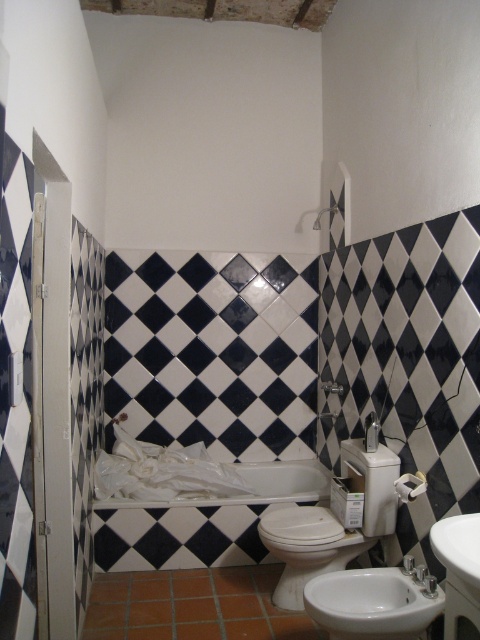
You are standing in the bathroom and want to reach the point marked at coordinates (x=400, y=600). Considering the bathroom layout described, can you estimate how far you need to move to reach that point?

The point at coordinates (x=400, y=600) is 6.83 feet away from the viewer, so you need to move approximately 6.83 feet to reach it.

You are designing a bathroom layout and want to ensure proper placement of the white glossy toilet bowl at lower center and the matte white shower at upper center. Based on their positions, which one is located lower in the image?

The white glossy toilet bowl at lower center is located lower than the matte white shower at upper center.

You are standing in the bathroom and need to locate the white glossy toilet bowl at lower center. According to the coordinates provided, where exactly is it positioned?

The white glossy toilet bowl at lower center is positioned at coordinates point (307, 547).